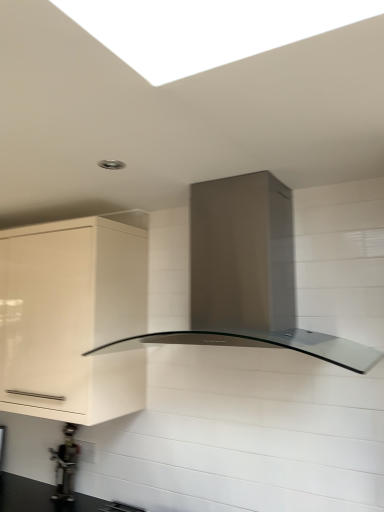
Image resolution: width=384 pixels, height=512 pixels. I want to click on vacant space situated above satin metallic range hood at center (from a real-world perspective), so click(243, 177).